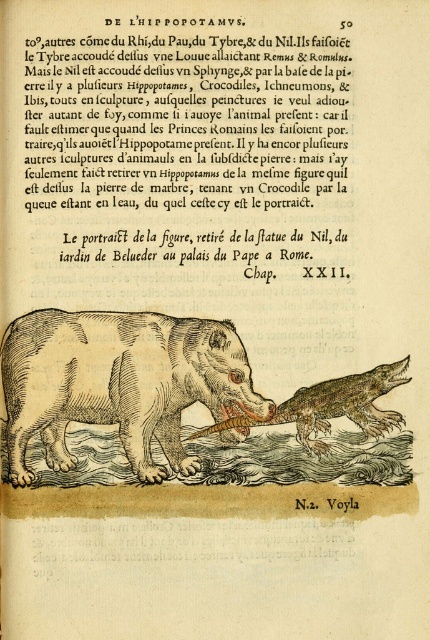
You are an art historian examining the engraving of the hippopotamus and crocodile. You notice two points marked on the image at coordinates point [55,104] and point [226,378]. Which of these points is nearer to the viewer in the engraving?

Point [55,104] is closer to the camera than point [226,378], so it is nearer to the viewer in the engraving.

You are an art conservator examining a historical book page. The page has a brown wood carving hippopotamus at center and a brown textured crocodile at center. Based on the illustration, which of these two objects is taller?

The brown wood carving hippopotamus at center is taller than the brown textured crocodile at center.

You are a translator working on a historical document. You notice two elements on the page described as the black wood text at upper center and the brown wood carving hippopotamus at center. Which element would be visible first if you were to glance at the page from a distance?

The black wood text at upper center is in front of the brown wood carving hippopotamus at center, so it would be the first element visible when glancing at the page from a distance.